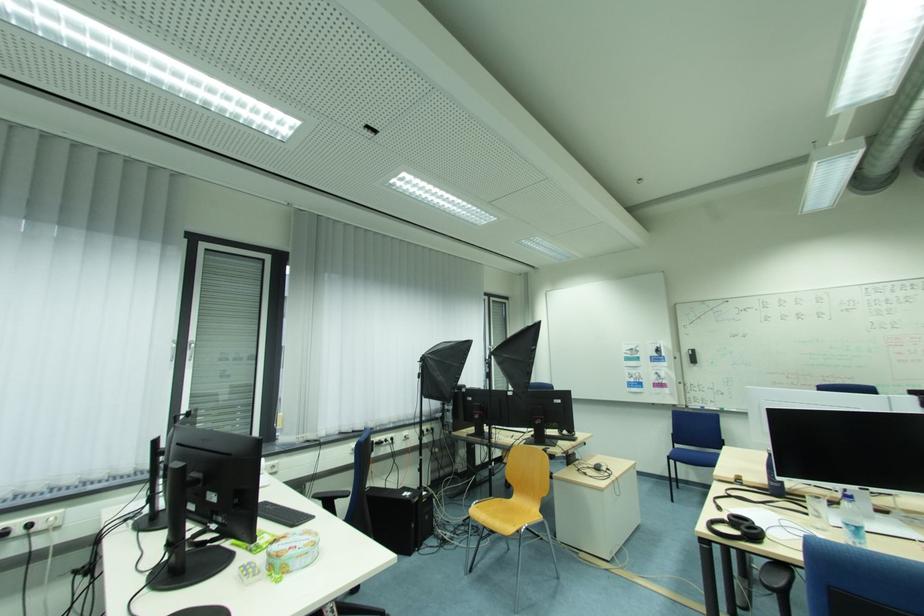
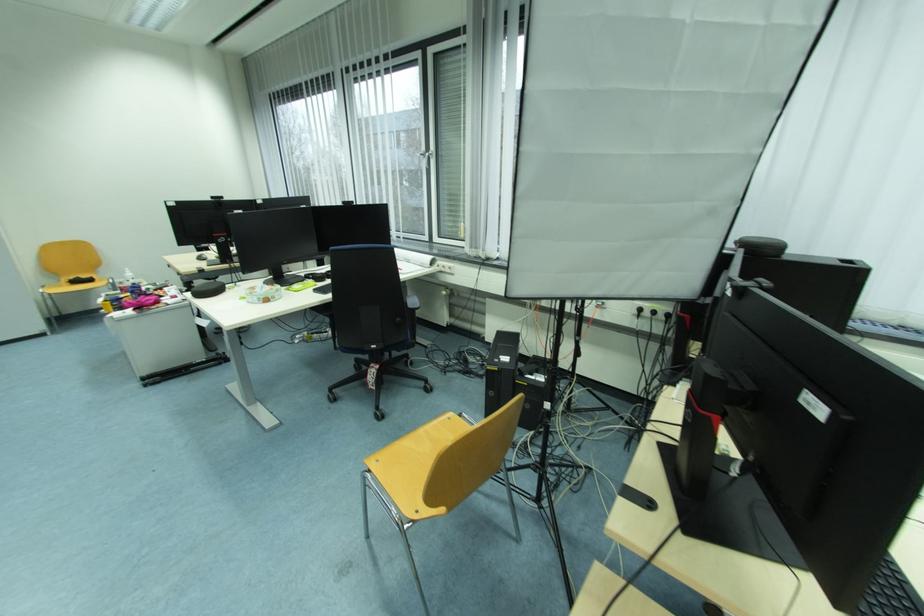
The point at [434,431] is marked in the first image. Where is the corresponding point in the second image?

(662, 314)